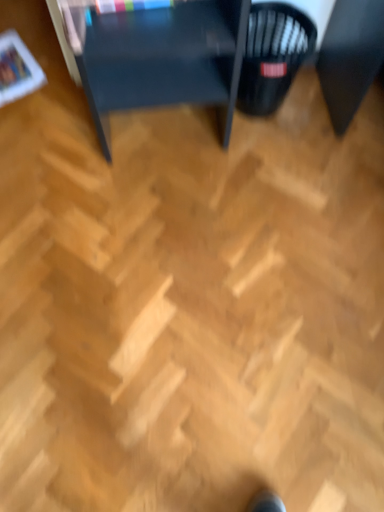
At what (x,y) coordinates should I click in order to perform the action: click on black plastic basket at center right. Please return your answer as a coordinate pair (x, y). Image resolution: width=384 pixels, height=512 pixels. Looking at the image, I should click on (273, 55).

The image size is (384, 512). Describe the element at coordinates (273, 55) in the screenshot. I see `black plastic basket at center right` at that location.

This screenshot has width=384, height=512. I want to click on matte black table at upper center, so click(159, 58).

The image size is (384, 512). What do you see at coordinates (159, 58) in the screenshot? I see `matte black table at upper center` at bounding box center [159, 58].

Locate an element on the screen. Image resolution: width=384 pixels, height=512 pixels. black plastic basket at center right is located at coordinates (273, 55).

Is matte black table at upper center to the right of black plastic basket at center right from the viewer's perspective?

Incorrect, matte black table at upper center is not on the right side of black plastic basket at center right.

Is matte black table at upper center in front of or behind black plastic basket at center right in the image?

Visually, matte black table at upper center is located in front of black plastic basket at center right.

Is point (113, 81) positioned in front of point (274, 6)?

Yes, point (113, 81) is closer to viewer.

From the image's perspective, is matte black table at upper center above black plastic basket at center right?

Yes, from the image's perspective, matte black table at upper center is above black plastic basket at center right.

From a real-world perspective, between matte black table at upper center and black plastic basket at center right, who is vertically lower?

From a 3D spatial view, black plastic basket at center right is below.

Does matte black table at upper center have a greater width compared to black plastic basket at center right?

Yes.

Considering the sizes of objects matte black table at upper center and black plastic basket at center right in the image provided, who is shorter, matte black table at upper center or black plastic basket at center right?

black plastic basket at center right.

Can you confirm if matte black table at upper center is bigger than black plastic basket at center right?

Yes.

Is matte black table at upper center situated inside black plastic basket at center right or outside?

matte black table at upper center lies outside black plastic basket at center right.

Would you consider matte black table at upper center to be distant from black plastic basket at center right?

No.

Is matte black table at upper center oriented away from black plastic basket at center right?

Absolutely, matte black table at upper center is directed away from black plastic basket at center right.

What's the angular difference between matte black table at upper center and black plastic basket at center right's facing directions?

0.496 degrees separate the facing orientations of matte black table at upper center and black plastic basket at center right.

Where is `basket beneath the matte black table at upper center (from a real-world perspective)`? The image size is (384, 512). basket beneath the matte black table at upper center (from a real-world perspective) is located at coordinates (273, 55).

Visually, is black plastic basket at center right positioned to the left or to the right of matte black table at upper center?

Clearly, black plastic basket at center right is on the right of matte black table at upper center in the image.

Considering the relative positions of black plastic basket at center right and matte black table at upper center in the image provided, is black plastic basket at center right behind matte black table at upper center?

Yes, it is.

Which is nearer, (268, 9) or (170, 34)?

The point (170, 34) is closer to the camera.

From the image's perspective, is black plastic basket at center right over matte black table at upper center?

No, from the image's perspective, black plastic basket at center right is not above matte black table at upper center.

From a real-world perspective, is black plastic basket at center right located higher than matte black table at upper center?

No, from a real-world perspective, black plastic basket at center right is not above matte black table at upper center.

Looking at their sizes, would you say black plastic basket at center right is wider or thinner than matte black table at upper center?

Clearly, black plastic basket at center right has less width compared to matte black table at upper center.

Is black plastic basket at center right shorter than matte black table at upper center?

Correct, black plastic basket at center right is not as tall as matte black table at upper center.

Who is smaller, black plastic basket at center right or matte black table at upper center?

With smaller size is black plastic basket at center right.

Is black plastic basket at center right not within matte black table at upper center?

No, black plastic basket at center right is not outside of matte black table at upper center.

Is black plastic basket at center right next to matte black table at upper center?

No, black plastic basket at center right is not in contact with matte black table at upper center.

Is black plastic basket at center right positioned with its back to matte black table at upper center?

Yes, black plastic basket at center right is positioned with its back facing matte black table at upper center.

Can you tell me how much black plastic basket at center right and matte black table at upper center differ in facing direction?

There is a 0.496-degree angle between the facing directions of black plastic basket at center right and matte black table at upper center.

The width and height of the screenshot is (384, 512). In order to click on table in front of the black plastic basket at center right in this screenshot , I will do `click(159, 58)`.

I want to click on basket below the matte black table at upper center (from the image's perspective), so click(273, 55).

Where is `basket behind the matte black table at upper center`? Image resolution: width=384 pixels, height=512 pixels. basket behind the matte black table at upper center is located at coordinates (273, 55).